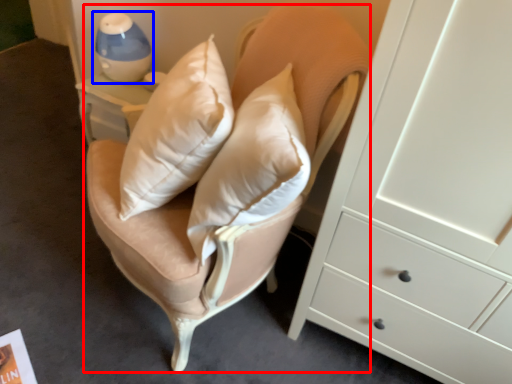
Question: Which of the following is the farthest to the observer, swivel chair (highlighted by a red box) or table lamp (highlighted by a blue box)?

Choices:
 (A) swivel chair
 (B) table lamp

Answer: (B)